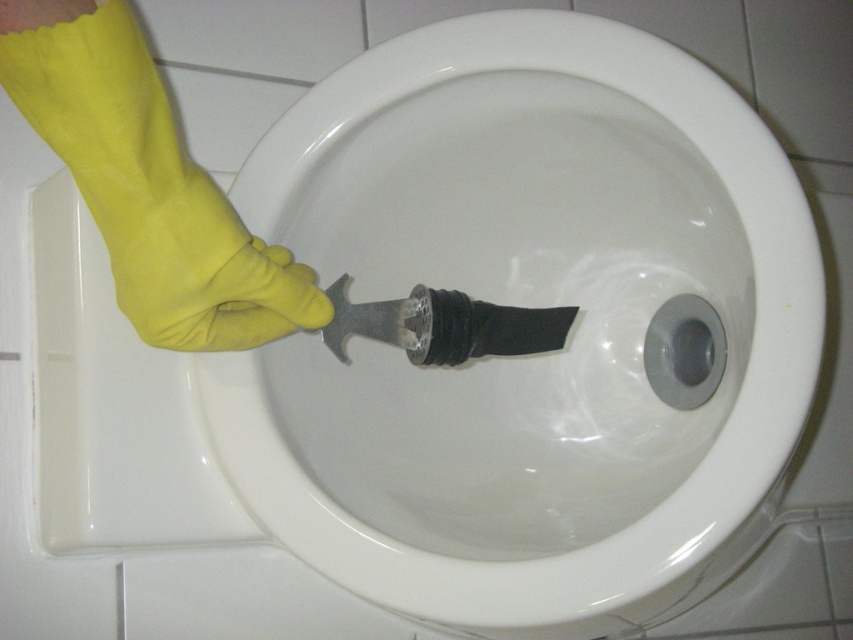
You are a cleaning inspector checking the bathroom. You notice the white glossy toilet bowl at center and the rubber glove at center. Which object is closer to you?

The rubber glove at center is closer to you because the white glossy toilet bowl at center is further away.

You are a cleaning inspector checking the proper use of gloves. You see the yellow rubber glove at left and the rubber glove at center. Which glove is on top?

The yellow rubber glove at left is positioned over the rubber glove at center, so the yellow rubber glove at left is on top.

You are a cleaning inspector checking the bathroom. You see the white glossy toilet bowl at center and the rubber glove at center. Which object is taller?

The white glossy toilet bowl at center is taller than the rubber glove at center.